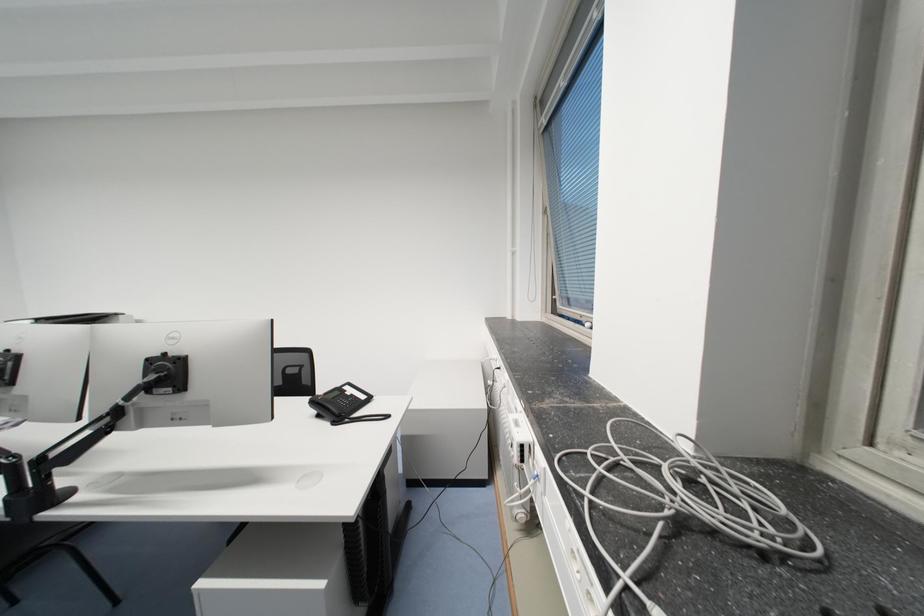
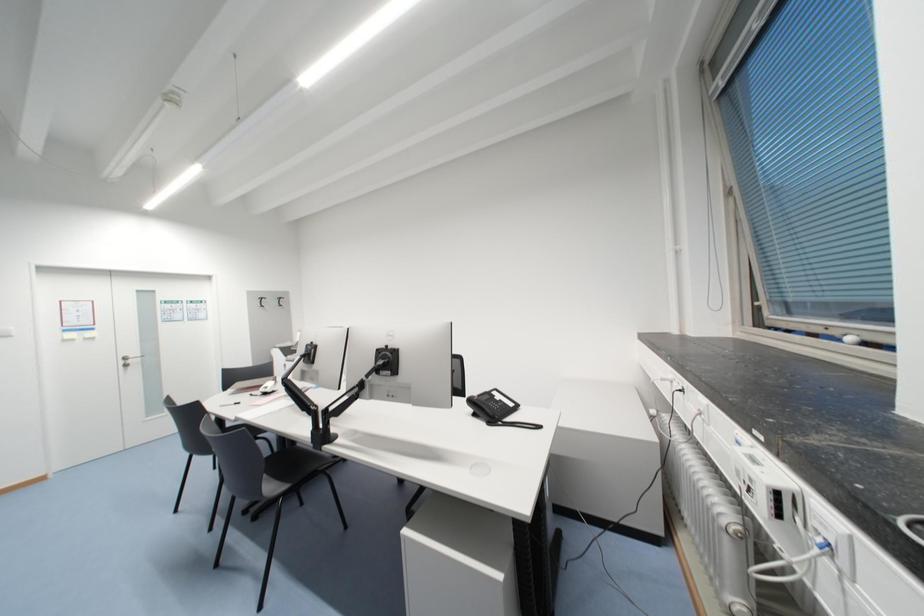
Question: In a continuous first-person perspective shot, in which direction is the camera moving?

Choices:
 (A) Left
 (B) Right
 (C) Forward
 (D) Backward

Answer: (A)